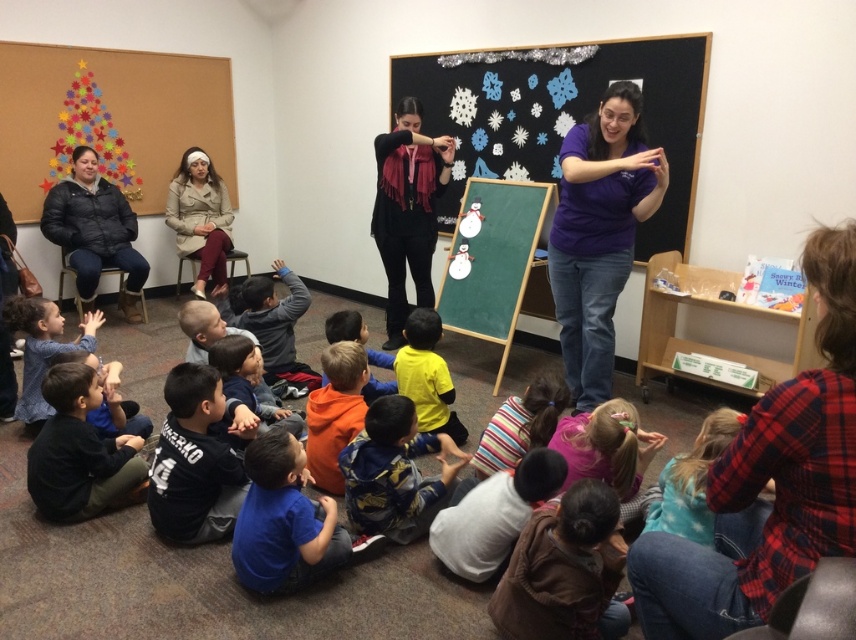
Question: Which point appears farthest from the camera in this image?

Choices:
 (A) (688, 74)
 (B) (403, 440)
 (C) (434, 410)

Answer: (A)

Question: Considering the real-world distances, which object is closest to the purple cotton shirt at center?

Choices:
 (A) blue cotton shirt at center
 (B) matte black chalkboard with snowflakes at upper center
 (C) brown fuzzy jacket at lower right
 (D) beige wool coat at upper left

Answer: (B)

Question: Does matte black chalkboard with snowflakes at upper center appear over beige wool coat at upper left?

Choices:
 (A) yes
 (B) no

Answer: (A)

Question: Observing the image, what is the correct spatial positioning of matte black chalkboard with snowflakes at upper center in reference to matte black jacket at left?

Choices:
 (A) below
 (B) above

Answer: (B)

Question: Is matte black chalkboard with snowflakes at upper center below blue cotton shirt at center?

Choices:
 (A) yes
 (B) no

Answer: (B)

Question: Which of these objects is positioned closest to the matte black jacket at left?

Choices:
 (A) brown fuzzy jacket at lower right
 (B) matte black chalkboard with snowflakes at upper center
 (C) purple cotton shirt at center
 (D) beige wool coat at upper left

Answer: (D)